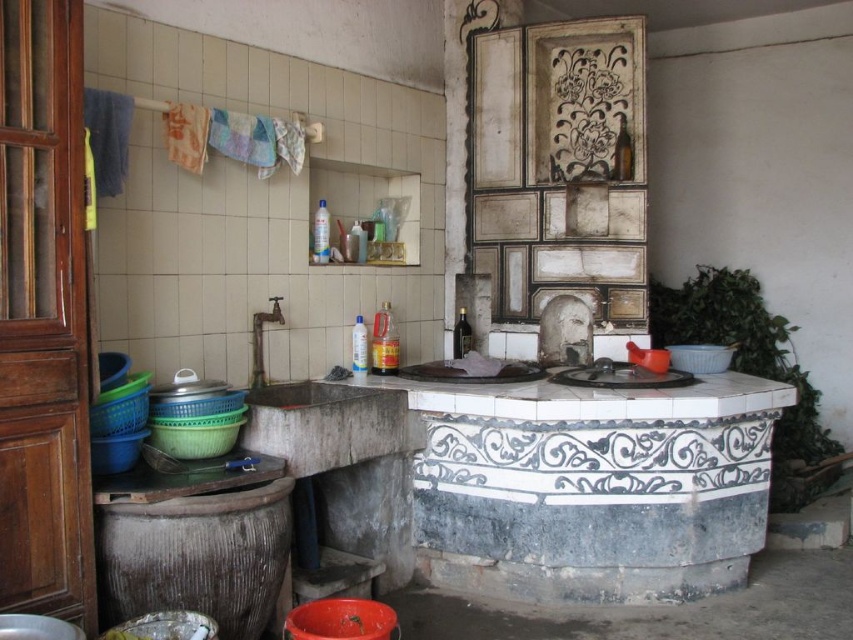
Which of these two, gray stone sink at center or black stone sink at center, stands shorter?

Standing shorter between the two is black stone sink at center.

What do you see at coordinates (306, 394) in the screenshot?
I see `gray stone sink at center` at bounding box center [306, 394].

You are a GUI agent. You are given a task and a screenshot of the screen. Output one action in this format:
    pyautogui.click(x=<x>, y=<y>)
    Task: Click on the gray stone sink at center
    This screenshot has height=640, width=853.
    Given the screenshot: What is the action you would take?
    pyautogui.click(x=306, y=394)

Between rusty metal sink at center and gray stone sink at center, which one is positioned higher?

Positioned higher is gray stone sink at center.

Is rusty metal sink at center positioned in front of gray stone sink at center?

That is True.

I want to click on rusty metal sink at center, so pos(328,424).

Does rusty metal sink at center appear on the right side of orange plastic stool at lower center?

No, rusty metal sink at center is not to the right of orange plastic stool at lower center.

Between rusty metal sink at center and orange plastic stool at lower center, which one appears on the left side from the viewer's perspective?

Positioned to the left is rusty metal sink at center.

Does point (369, 417) lie in front of point (360, 589)?

That is True.

Find the location of a particular element. This screenshot has width=853, height=640. rusty metal sink at center is located at coordinates click(x=328, y=424).